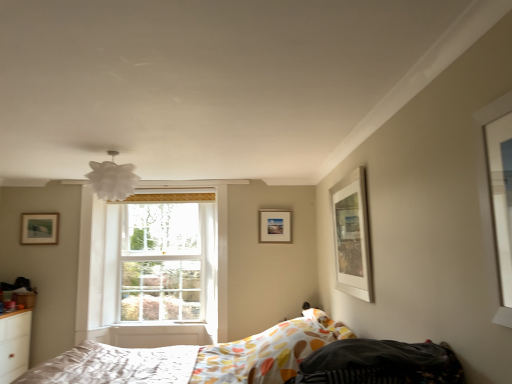
Question: Considering the relative sizes of patterned fabric mattress at lower right, the second mattress from the bottom, and white matte picture frame at upper right, marked as the third picture frame in a left-to-right arrangement, in the image provided, is patterned fabric mattress at lower right, the second mattress from the bottom, shorter than white matte picture frame at upper right, marked as the third picture frame in a left-to-right arrangement,?

Choices:
 (A) yes
 (B) no

Answer: (A)

Question: From the image's perspective, is patterned fabric mattress at lower right, which is the first mattress in top-to-bottom order, above white matte picture frame at upper right, which appears as the 3th picture frame when viewed from the back?

Choices:
 (A) no
 (B) yes

Answer: (A)

Question: Considering the relative sizes of patterned fabric mattress at lower right, which is the first mattress in top-to-bottom order, and white matte picture frame at upper right, which is counted as the 1th picture frame, starting from the front, in the image provided, is patterned fabric mattress at lower right, which is the first mattress in top-to-bottom order, thinner than white matte picture frame at upper right, which is counted as the 1th picture frame, starting from the front,?

Choices:
 (A) no
 (B) yes

Answer: (A)

Question: Can you confirm if patterned fabric mattress at lower right, the second mattress from the bottom, is bigger than white matte picture frame at upper right, which is counted as the 1th picture frame, starting from the front?

Choices:
 (A) no
 (B) yes

Answer: (B)

Question: Would you say patterned fabric mattress at lower right, the second mattress from the bottom, is outside white matte picture frame at upper right, which is counted as the 1th picture frame, starting from the front?

Choices:
 (A) no
 (B) yes

Answer: (B)

Question: Considering the relative sizes of patterned fabric mattress at lower right, the second mattress positioned from the left, and white matte picture frame at upper right, arranged as the 1th picture frame when viewed from the right, in the image provided, is patterned fabric mattress at lower right, the second mattress positioned from the left, smaller than white matte picture frame at upper right, arranged as the 1th picture frame when viewed from the right,?

Choices:
 (A) no
 (B) yes

Answer: (A)

Question: Could you tell me if white fabric mattress at lower left, the first mattress in the back-to-front sequence, is facing clear glass window at center?

Choices:
 (A) yes
 (B) no

Answer: (B)

Question: From a real-world perspective, is white fabric mattress at lower left, arranged as the first mattress when ordered from the bottom, over clear glass window at center?

Choices:
 (A) no
 (B) yes

Answer: (A)

Question: Is white fabric mattress at lower left, placed as the second mattress when sorted from top to bottom, thinner than clear glass window at center?

Choices:
 (A) yes
 (B) no

Answer: (B)

Question: Would you say white fabric mattress at lower left, the first mattress in the back-to-front sequence, is outside clear glass window at center?

Choices:
 (A) yes
 (B) no

Answer: (A)

Question: From the image's perspective, does white fabric mattress at lower left, the first mattress in the back-to-front sequence, appear lower than clear glass window at center?

Choices:
 (A) yes
 (B) no

Answer: (A)

Question: Can you confirm if white fabric mattress at lower left, acting as the second mattress starting from the right, is wider than clear glass window at center?

Choices:
 (A) yes
 (B) no

Answer: (A)

Question: Considering the relative sizes of wooden picture frame at upper left, marked as the 2th picture frame in a back-to-front arrangement, and white matte picture frame at upper right, arranged as the 1th picture frame when viewed from the right, in the image provided, is wooden picture frame at upper left, marked as the 2th picture frame in a back-to-front arrangement, bigger than white matte picture frame at upper right, arranged as the 1th picture frame when viewed from the right,?

Choices:
 (A) yes
 (B) no

Answer: (B)